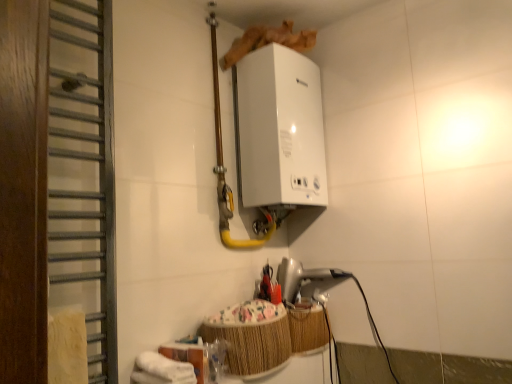
Question: Is wooden towel rack at left at the back of woven bamboo basket at lower center?

Choices:
 (A) yes
 (B) no

Answer: (B)

Question: Is woven bamboo basket at lower center to the right of wooden towel rack at left from the viewer's perspective?

Choices:
 (A) no
 (B) yes

Answer: (B)

Question: Is woven bamboo basket at lower center far from wooden towel rack at left?

Choices:
 (A) no
 (B) yes

Answer: (A)

Question: Can you see woven bamboo basket at lower center touching wooden towel rack at left?

Choices:
 (A) no
 (B) yes

Answer: (A)

Question: From the image's perspective, is woven bamboo basket at lower center below wooden towel rack at left?

Choices:
 (A) no
 (B) yes

Answer: (B)

Question: Considering the relative positions of woven bamboo basket at lower center and wooden towel rack at left in the image provided, is woven bamboo basket at lower center to the left of wooden towel rack at left from the viewer's perspective?

Choices:
 (A) yes
 (B) no

Answer: (B)

Question: Can you confirm if woven bamboo basket at lower center is wider than white glossy boiler at upper center, the 2th appliance when ordered from bottom to top?

Choices:
 (A) no
 (B) yes

Answer: (B)

Question: Is woven bamboo basket at lower center completely or partially outside of white glossy boiler at upper center, the 2th appliance when ordered from bottom to top?

Choices:
 (A) yes
 (B) no

Answer: (A)

Question: From a real-world perspective, does woven bamboo basket at lower center stand above white glossy boiler at upper center, which is the first appliance in top-to-bottom order?

Choices:
 (A) no
 (B) yes

Answer: (A)

Question: Is woven bamboo basket at lower center thinner than white glossy boiler at upper center, the 2th appliance when ordered from bottom to top?

Choices:
 (A) yes
 (B) no

Answer: (B)

Question: Is white glossy boiler at upper center, the 2th appliance when ordered from bottom to top, located within woven bamboo basket at lower center?

Choices:
 (A) no
 (B) yes

Answer: (A)

Question: Is woven bamboo basket at lower center positioned before white glossy boiler at upper center, which is the first appliance in top-to-bottom order?

Choices:
 (A) yes
 (B) no

Answer: (A)

Question: Is silver metallic hairdryer at lower center, which is the first appliance from bottom to top, taller than wooden towel rack at left?

Choices:
 (A) no
 (B) yes

Answer: (A)